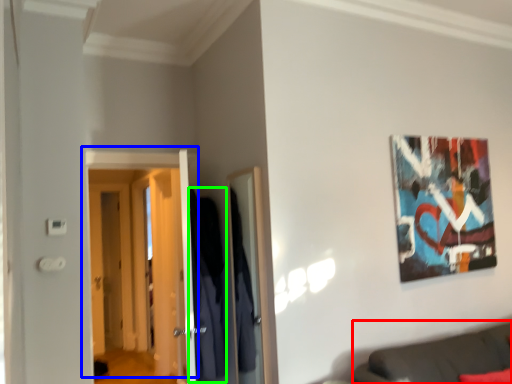
Question: Which object is positioned closest to couch (highlighted by a red box)? Select from door (highlighted by a blue box) and robe (highlighted by a green box).

Choices:
 (A) door
 (B) robe

Answer: (B)